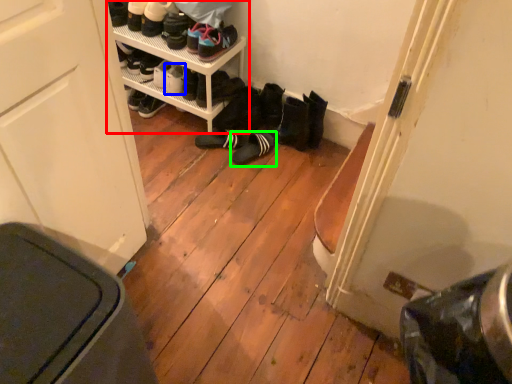
Question: Considering the real-world distances, which object is farthest from shelf (highlighted by a red box)? footwear (highlighted by a blue box) or footwear (highlighted by a green box)?

Choices:
 (A) footwear
 (B) footwear

Answer: (B)